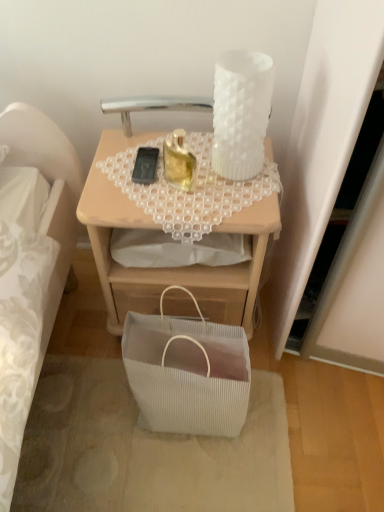
At what (x,y) coordinates should I click in order to perform the action: click on vacant space that is in between white frosted glass candle holder at upper right, which appears as the 1th candle holder when viewed from the right, and black matte mobile phone at center. Please return your answer as a coordinate pair (x, y). This screenshot has height=512, width=384. Looking at the image, I should click on (188, 160).